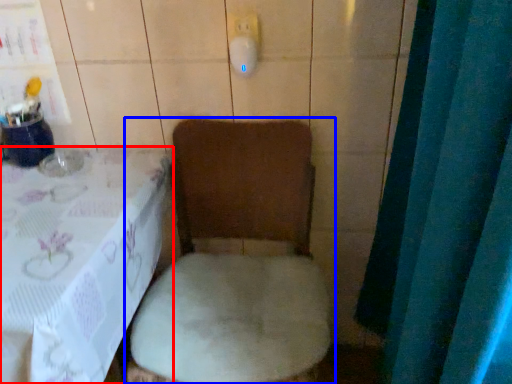
Question: Which of the following is the farthest to the observer, furniture (highlighted by a red box) or toilet (highlighted by a blue box)?

Choices:
 (A) furniture
 (B) toilet

Answer: (B)